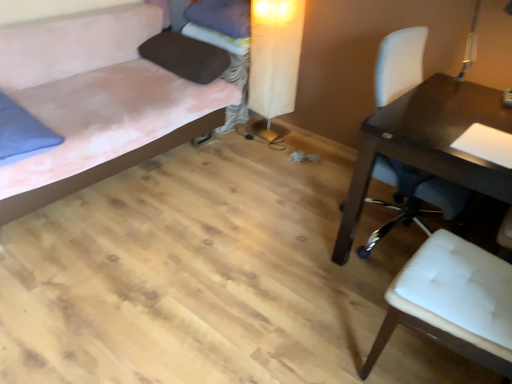
Question: Considering the relative positions of suede-like pink bed at left and white leather chair at right, the 1th chair viewed from the back, in the image provided, is suede-like pink bed at left to the left or to the right of white leather chair at right, the 1th chair viewed from the back,?

Choices:
 (A) left
 (B) right

Answer: (A)

Question: Is suede-like pink bed at left bigger or smaller than white leather chair at right, the 1th chair viewed from the back?

Choices:
 (A) big
 (B) small

Answer: (A)

Question: Estimate the real-world distances between objects in this image. Which object is closer to the white leather chair at right, which is counted as the 2th chair, starting from the back?

Choices:
 (A) brown fabric pillow at upper center, the 2th pillow positioned from the top
 (B) blue fabric pillow at left, the first pillow in the bottom-to-top sequence
 (C) beige fabric table lamp at center
 (D) white leather chair at right, the 1th chair viewed from the back
 (E) suede-like pink bed at left

Answer: (D)

Question: Which object is the farthest from the beige fabric table lamp at center?

Choices:
 (A) white leather chair at right, which ranks as the second chair in front-to-back order
 (B) suede-like pink bed at left
 (C) brown fabric pillow at upper center, the second pillow positioned from the bottom
 (D) blue fabric pillow at left, the first pillow in the bottom-to-top sequence
 (E) white leather chair at right, the first chair from the front

Answer: (E)